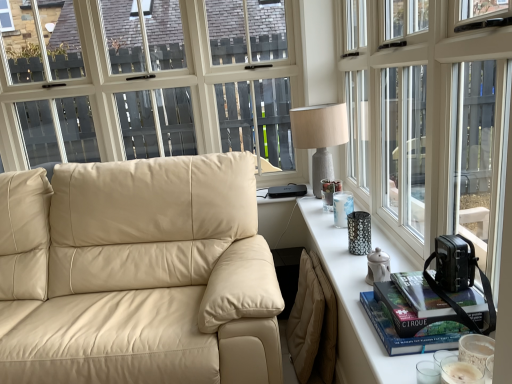
Question: Considering the relative sizes of textured gray lamp at upper right and beige leather couch at left in the image provided, is textured gray lamp at upper right taller than beige leather couch at left?

Choices:
 (A) no
 (B) yes

Answer: (A)

Question: From a real-world perspective, is textured gray lamp at upper right physically above beige leather couch at left?

Choices:
 (A) no
 (B) yes

Answer: (B)

Question: Can you confirm if textured gray lamp at upper right is bigger than beige leather couch at left?

Choices:
 (A) no
 (B) yes

Answer: (A)

Question: Would you say beige leather couch at left is part of textured gray lamp at upper right's contents?

Choices:
 (A) no
 (B) yes

Answer: (A)

Question: Is textured gray lamp at upper right facing away from beige leather couch at left?

Choices:
 (A) yes
 (B) no

Answer: (B)

Question: Does textured gray lamp at upper right have a greater width compared to beige leather couch at left?

Choices:
 (A) no
 (B) yes

Answer: (A)

Question: Is transparent glass window at upper right taller than hardcover book at right, arranged as the second book when ordered from the bottom?

Choices:
 (A) no
 (B) yes

Answer: (B)

Question: From the image's perspective, is transparent glass window at upper right beneath hardcover book at right, arranged as the second book when ordered from the bottom?

Choices:
 (A) no
 (B) yes

Answer: (A)

Question: Is transparent glass window at upper right looking in the opposite direction of hardcover book at right, which appears as the first book when viewed from the top?

Choices:
 (A) yes
 (B) no

Answer: (A)

Question: Is transparent glass window at upper right not near hardcover book at right, which appears as the first book when viewed from the top?

Choices:
 (A) no
 (B) yes

Answer: (A)

Question: Considering the relative sizes of transparent glass window at upper right and hardcover book at right, arranged as the second book when ordered from the bottom, in the image provided, is transparent glass window at upper right wider than hardcover book at right, arranged as the second book when ordered from the bottom,?

Choices:
 (A) yes
 (B) no

Answer: (B)

Question: Considering the relative sizes of transparent glass window at upper right and hardcover book at right, which appears as the first book when viewed from the top, in the image provided, is transparent glass window at upper right shorter than hardcover book at right, which appears as the first book when viewed from the top,?

Choices:
 (A) no
 (B) yes

Answer: (A)

Question: Is textured gray lamp at upper right positioned beyond the bounds of hardcover book at right, marked as the first book in a bottom-to-top arrangement?

Choices:
 (A) yes
 (B) no

Answer: (A)